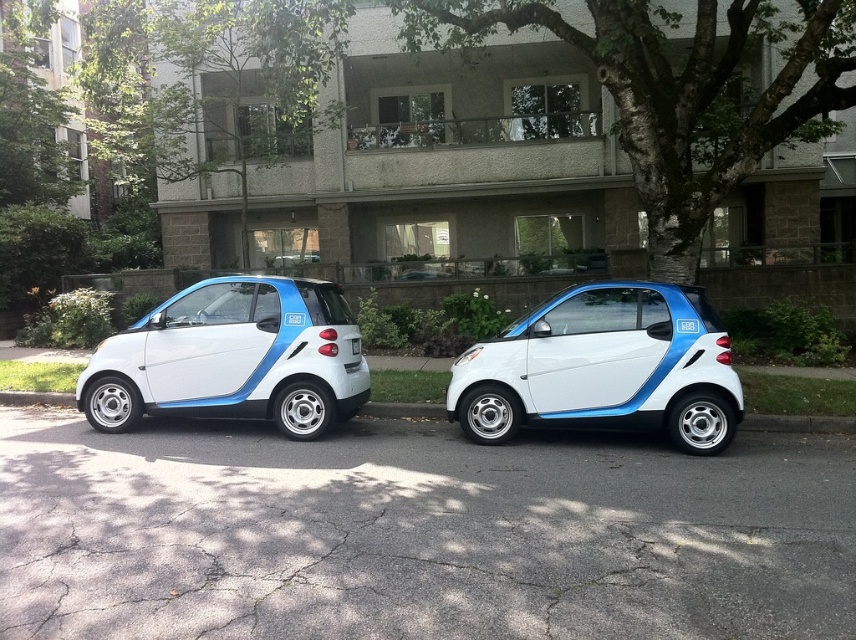
Does white matte smart car at center appear on the right side of white matte smart car at left?

Yes, white matte smart car at center is to the right of white matte smart car at left.

Between white matte smart car at center and white matte smart car at left, which one has more height?

Standing taller between the two is white matte smart car at left.

Locate an element on the screen. Image resolution: width=856 pixels, height=640 pixels. white matte smart car at center is located at coordinates (604, 368).

Does white matte smart car at center appear on the left side of gray asphalt curb at lower center?

No, white matte smart car at center is not to the left of gray asphalt curb at lower center.

Which of these two, white matte smart car at center or gray asphalt curb at lower center, stands taller?

white matte smart car at center is taller.

The width and height of the screenshot is (856, 640). Identify the location of white matte smart car at center. click(x=604, y=368).

Is white matte smart car at left wider than gray asphalt curb at lower center?

Incorrect, white matte smart car at left's width does not surpass gray asphalt curb at lower center's.

Measure the distance between white matte smart car at left and gray asphalt curb at lower center.

white matte smart car at left and gray asphalt curb at lower center are 6.19 feet apart.

Where is `white matte smart car at left`? Image resolution: width=856 pixels, height=640 pixels. white matte smart car at left is located at coordinates (233, 358).